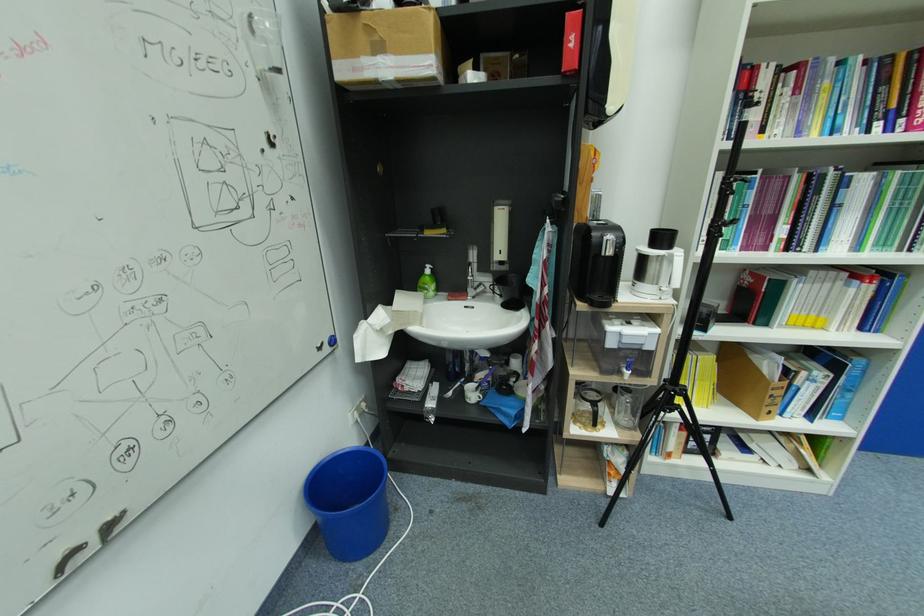
Image resolution: width=924 pixels, height=616 pixels. Find the location of `green dispenser pump`. green dispenser pump is located at coordinates (598, 257).